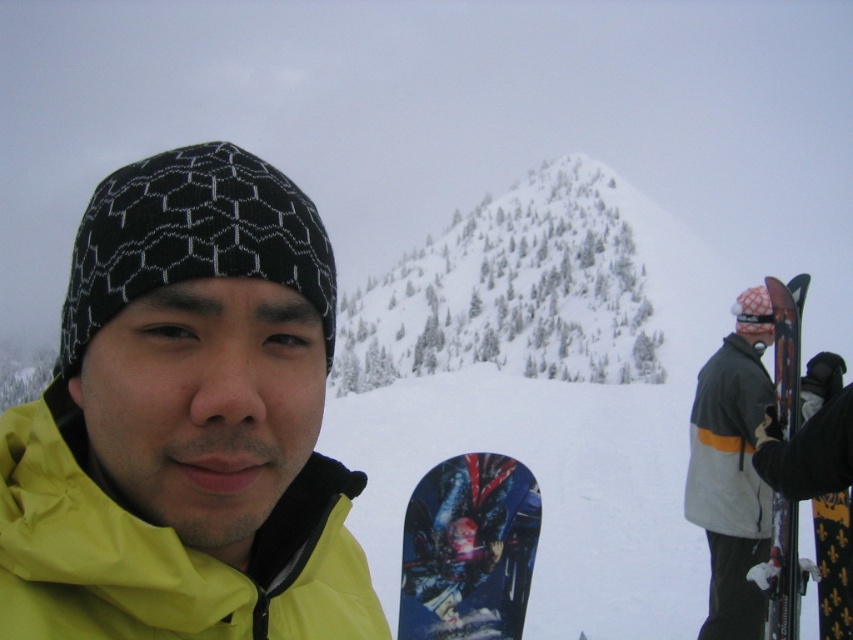
Question: Based on their relative distances, which object is nearer to the blue glossy snowboard at right?

Choices:
 (A) yellow matte jacket at lower left
 (B) gray fleece jacket at right
 (C) shiny blue snowboard at center
 (D) gray woolen jacket at right

Answer: (D)

Question: Can you confirm if yellow matte jacket at lower left is wider than gray fleece jacket at right?

Choices:
 (A) no
 (B) yes

Answer: (A)

Question: Does shiny blue snowboard at center have a lesser width compared to gray woolen jacket at right?

Choices:
 (A) no
 (B) yes

Answer: (B)

Question: Which is nearer to the yellow matte jacket at lower left?

Choices:
 (A) shiny blue snowboard at center
 (B) blue glossy snowboard at right
 (C) gray fleece jacket at right
 (D) gray woolen jacket at right

Answer: (A)

Question: Which object is the closest to the blue glossy snowboard at right?

Choices:
 (A) gray woolen jacket at right
 (B) shiny blue snowboard at center

Answer: (A)

Question: Can you confirm if yellow matte jacket at lower left is thinner than shiny blue snowboard at center?

Choices:
 (A) no
 (B) yes

Answer: (A)